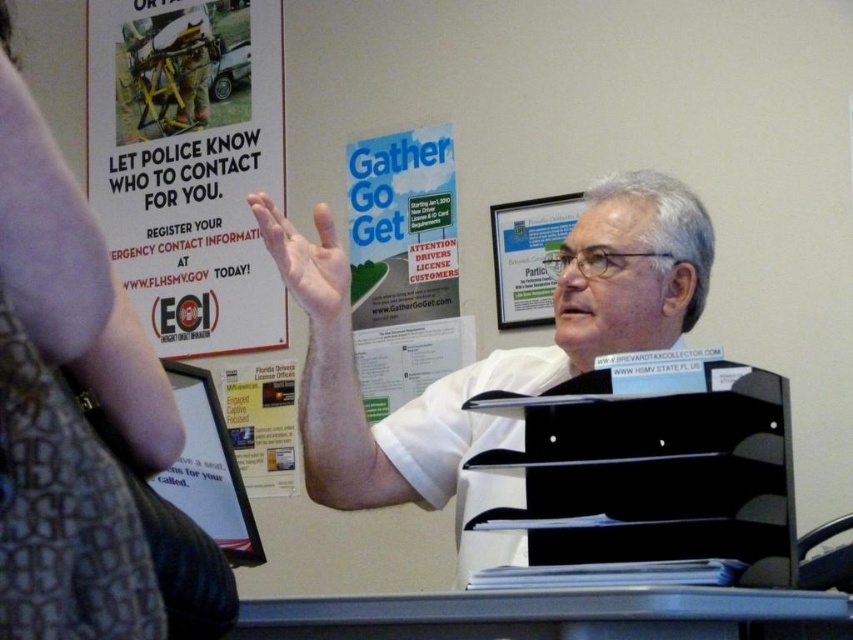
You are organizing a community event and need to display two items on a table. You have a black plastic file at center and a matte paper poster at center. Which item will you place on the lower shelf if you want to follow the rule of placing taller items on higher shelves?

The black plastic file at center has a lesser height compared to the matte paper poster at center, so you should place the black plastic file at center on the lower shelf since it is shorter.

You are a person standing in the room and want to see the text on the black plastic file at center. Can you see it clearly without moving the white matte shirt at center?

The black plastic file at center is behind the white matte shirt at center, so you cannot see it clearly without moving the white matte shirt at center.